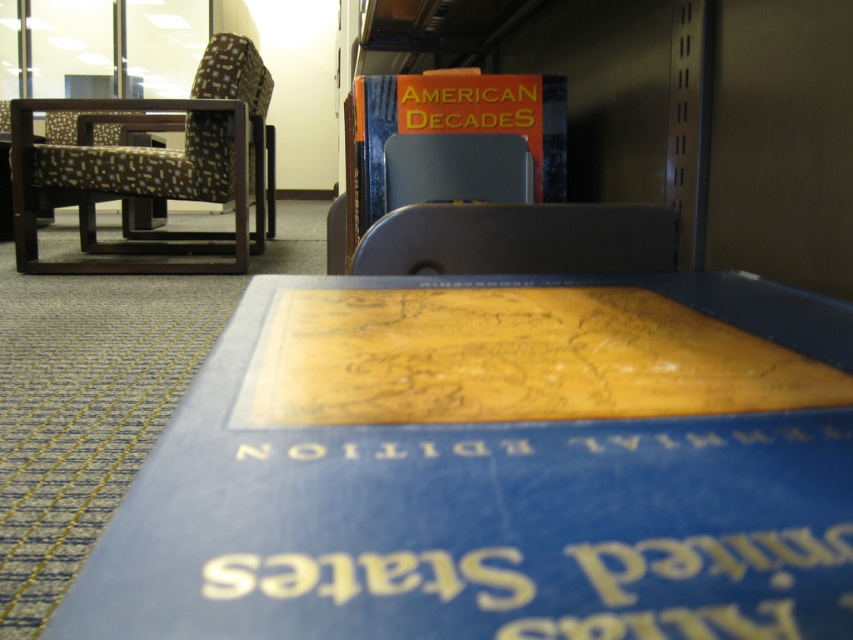
You are a student who needs to reach the orange matte book at upper center on the shelf. You are 1.6 meters tall. Can you comfortably reach it without standing on something?

The orange matte book at upper center is 1.27 meters away from the viewer. Since the average comfortable reaching height for a person of your height is typically around 2 meters, you can comfortably reach it without needing to stand on something.

You are organizing a study session and need to place a notebook between the brown fabric chair at left and the orange matte book at upper center. Considering their sizes, which object should you place the notebook closer to?

Since the brown fabric chair at left is larger in size than the orange matte book at upper center, you should place the notebook closer to the orange matte book at upper center to ensure there is enough space between them.

You are organizing books on a shelf and need to place a new book at position coordinates 0.222, 0.533. Is there already an orange matte book at upper center in that location?

Yes, the orange matte book at upper center is already located at point (454, 141), so placing another book there would displace it.